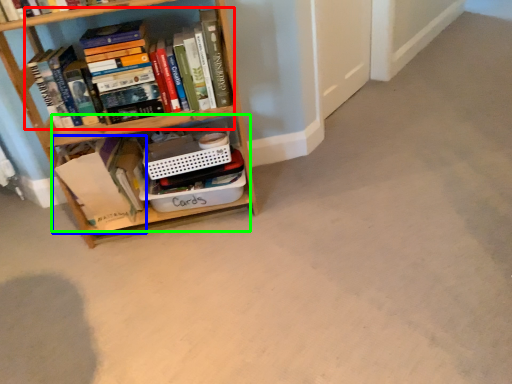
Question: Which object is the closest to the book (highlighted by a red box)? Choose among these: book (highlighted by a blue box) or cabinet (highlighted by a green box).

Choices:
 (A) book
 (B) cabinet

Answer: (B)